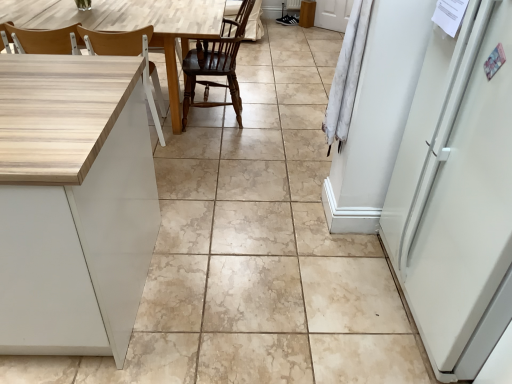
Question: From a real-world perspective, is wooden at left, which appears as the second chair when viewed from the right, physically above dark wood chair at center, which is the first chair from right to left?

Choices:
 (A) yes
 (B) no

Answer: (B)

Question: Considering the relative sizes of wooden at left, which appears as the second chair when viewed from the right, and dark wood chair at center, the second chair from the left, in the image provided, is wooden at left, which appears as the second chair when viewed from the right, smaller than dark wood chair at center, the second chair from the left,?

Choices:
 (A) yes
 (B) no

Answer: (A)

Question: Is wooden at left, the 1th chair viewed from the left, completely or partially outside of dark wood chair at center, which is the first chair from right to left?

Choices:
 (A) no
 (B) yes

Answer: (B)

Question: From the image's perspective, is wooden at left, which appears as the second chair when viewed from the right, under dark wood chair at center, the second chair from the left?

Choices:
 (A) yes
 (B) no

Answer: (A)

Question: Can you confirm if wooden at left, which appears as the second chair when viewed from the right, is positioned to the left of dark wood chair at center, the second chair from the left?

Choices:
 (A) yes
 (B) no

Answer: (A)

Question: In terms of width, does dark wood chair at center, which is the first chair from right to left, look wider or thinner when compared to light wood table at left?

Choices:
 (A) thin
 (B) wide

Answer: (A)

Question: Based on their positions, is dark wood chair at center, the second chair from the left, located to the left or right of light wood table at left?

Choices:
 (A) left
 (B) right

Answer: (B)

Question: From the image's perspective, relative to light wood table at left, is dark wood chair at center, which is the first chair from right to left, above or below?

Choices:
 (A) above
 (B) below

Answer: (B)

Question: Considering the positions of dark wood chair at center, which is the first chair from right to left, and light wood table at left in the image, is dark wood chair at center, which is the first chair from right to left, bigger or smaller than light wood table at left?

Choices:
 (A) big
 (B) small

Answer: (B)

Question: Is wooden at left, the 1th chair viewed from the left, taller or shorter than light wood table at left?

Choices:
 (A) tall
 (B) short

Answer: (A)

Question: Do you think wooden at left, which appears as the second chair when viewed from the right, is within light wood table at left, or outside of it?

Choices:
 (A) outside
 (B) inside

Answer: (B)

Question: Considering their positions, is wooden at left, the 1th chair viewed from the left, located in front of or behind light wood table at left?

Choices:
 (A) behind
 (B) front

Answer: (B)

Question: From a real-world perspective, is wooden at left, the 1th chair viewed from the left, positioned above or below light wood table at left?

Choices:
 (A) above
 (B) below

Answer: (A)

Question: Is wooden at left, which appears as the second chair when viewed from the right, bigger or smaller than dark wood chair at center, which is the first chair from right to left?

Choices:
 (A) small
 (B) big

Answer: (A)

Question: In terms of height, does wooden at left, the 1th chair viewed from the left, look taller or shorter compared to dark wood chair at center, which is the first chair from right to left?

Choices:
 (A) tall
 (B) short

Answer: (B)